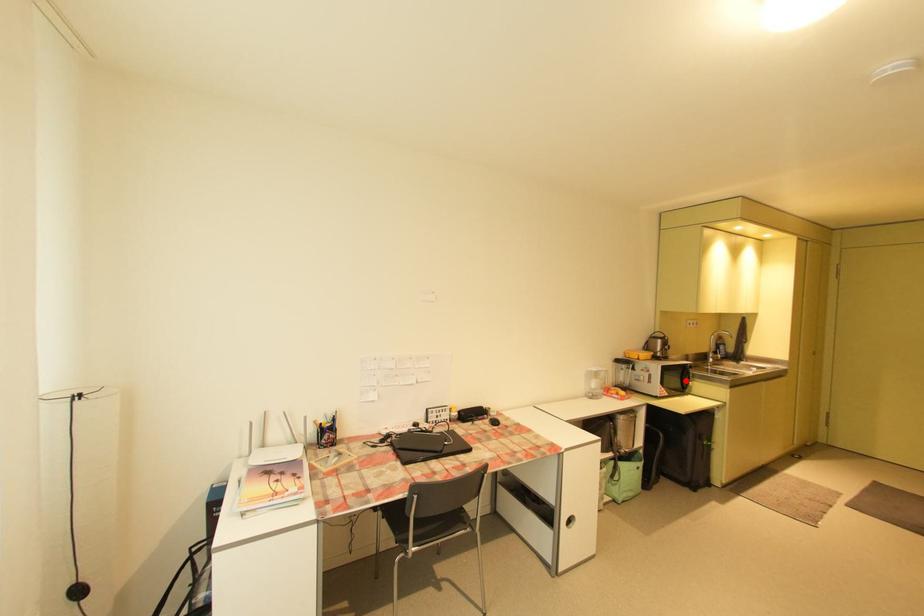
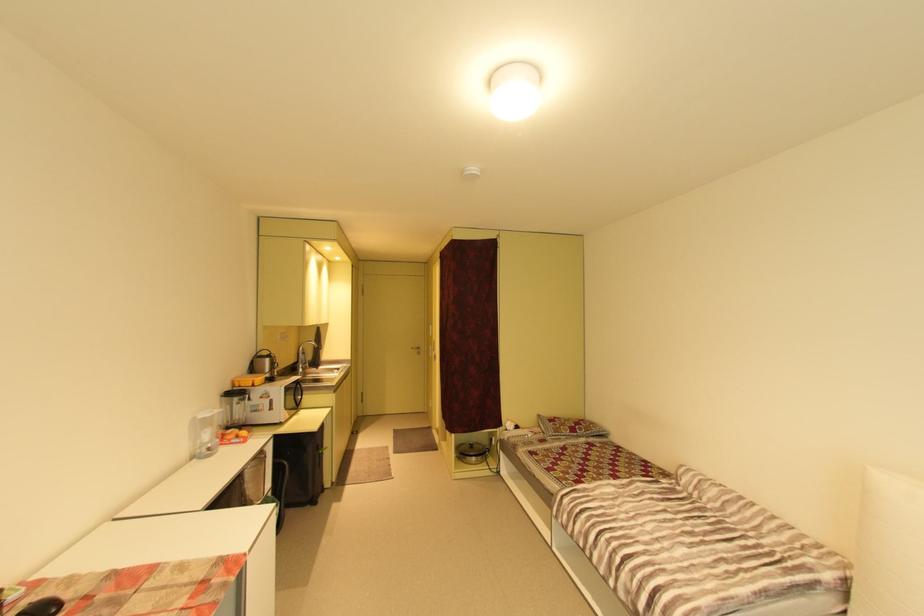
Question: I am providing you with two images of the same scene from different viewpoints. A red point is shown in image1. For the corresponding object point in image2, is it positioned nearer or farther from the camera?

Choices:
 (A) Nearer
 (B) Farther

Answer: (A)